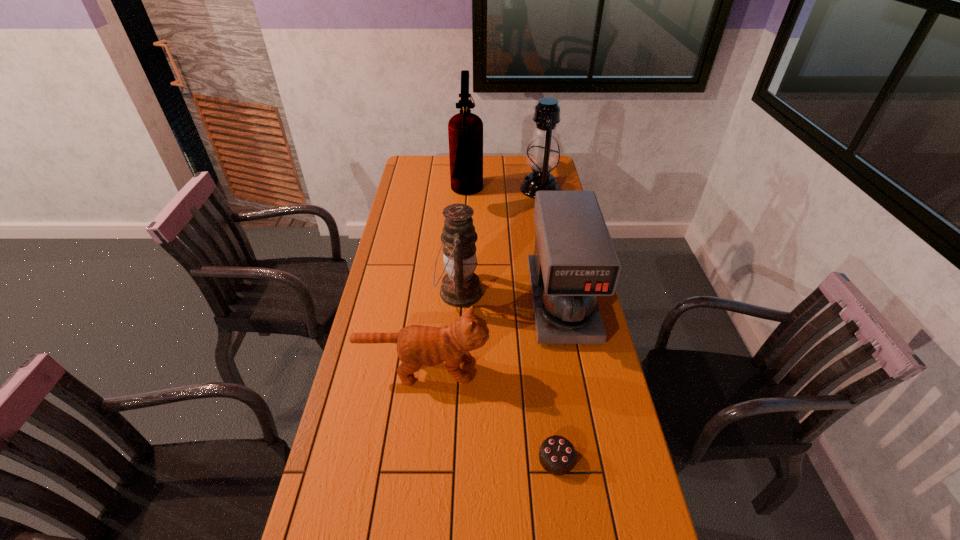
The image size is (960, 540). I want to click on fire extinguisher, so click(x=465, y=130).

Where is `the farther lantern`? This screenshot has width=960, height=540. the farther lantern is located at coordinates (543, 156).

Where is `the left lantern`? the left lantern is located at coordinates (461, 287).

Where is `the nearer lantern`? The width and height of the screenshot is (960, 540). the nearer lantern is located at coordinates (461, 287).

Find the location of `coffee maker`. coffee maker is located at coordinates (574, 261).

Identify the location of the fifth tallest object. (417, 345).

I want to click on cat, so click(417, 345).

What are the coordinates of `the shortest object` in the screenshot? It's located at (557, 455).

The image size is (960, 540). I want to click on chocolate cake, so click(557, 455).

Where is `vacant space located 0.290m at the nozzle of the tallest object`? Image resolution: width=960 pixels, height=540 pixels. vacant space located 0.290m at the nozzle of the tallest object is located at coordinates (545, 194).